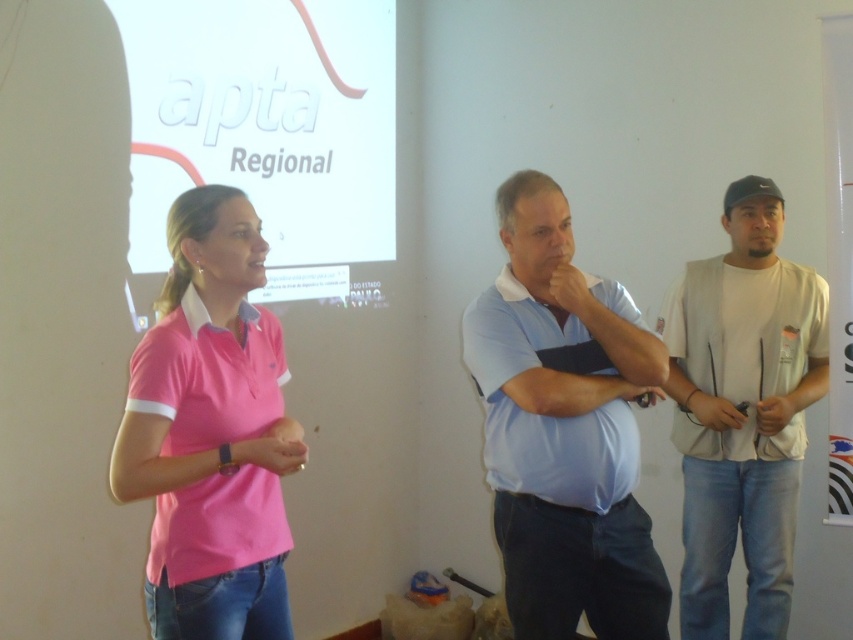
Does pink cotton shirt at center have a greater width compared to white matte t-shirt at right?

Yes.

Who is positioned more to the right, pink cotton shirt at center or white matte t-shirt at right?

From the viewer's perspective, white matte t-shirt at right appears more on the right side.

Is point (161, 374) more distant than point (775, 410)?

No, (161, 374) is in front of (775, 410).

Identify the location of pink cotton shirt at center. (212, 433).

Which of these two, pink cotton shirt at center or white cotton shirt at right, stands shorter?

pink cotton shirt at center is shorter.

Is pink cotton shirt at center shorter than white cotton shirt at right?

Correct, pink cotton shirt at center is not as tall as white cotton shirt at right.

Is point (169, 627) in front of point (767, 433)?

Yes, point (169, 627) is closer to viewer.

Locate an element on the screen. The width and height of the screenshot is (853, 640). pink cotton shirt at center is located at coordinates (212, 433).

Does point (662, 611) come in front of point (527, 381)?

No, (662, 611) is behind (527, 381).

Describe the element at coordinates (564, 429) in the screenshot. Image resolution: width=853 pixels, height=640 pixels. I see `light blue shirt at center` at that location.

Between point (526, 493) and point (521, 349), which one is positioned in front?

Point (521, 349)

The image size is (853, 640). In order to click on light blue shirt at center in this screenshot , I will do `click(564, 429)`.